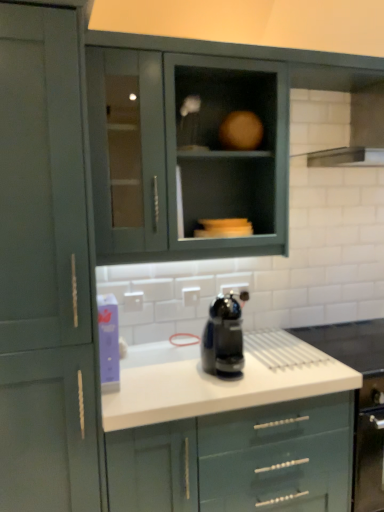
Locate an element on the screen. This screenshot has width=384, height=512. black glossy coffee maker at center is located at coordinates (223, 338).

The image size is (384, 512). Identify the location of matte gray cabinet at upper center, which is the second cabinetry from left to right. (187, 155).

Describe the element at coordinates (338, 126) in the screenshot. I see `stainless steel exhaust hood at upper right` at that location.

The image size is (384, 512). Describe the element at coordinates (44, 269) in the screenshot. I see `matte green cabinet at left, the 1th cabinetry viewed from the left` at that location.

Identify the location of white glossy countertop at center, placed as the 1th cabinetry when sorted from right to left. This screenshot has width=384, height=512. (238, 460).

Based on their positions, is white glossy countertop at center, marked as the 3th cabinetry in a left-to-right arrangement, located to the left or right of matte green cabinet at left, the 1th cabinetry viewed from the left?

Based on their positions, white glossy countertop at center, marked as the 3th cabinetry in a left-to-right arrangement, is located to the right of matte green cabinet at left, the 1th cabinetry viewed from the left.

How different are the orientations of white glossy countertop at center, marked as the 3th cabinetry in a left-to-right arrangement, and matte green cabinet at left, the 1th cabinetry viewed from the left, in degrees?

white glossy countertop at center, marked as the 3th cabinetry in a left-to-right arrangement, and matte green cabinet at left, the 1th cabinetry viewed from the left, are facing 0.000474 degrees away from each other.

From the image's perspective, is white glossy countertop at center, placed as the 1th cabinetry when sorted from right to left, positioned above or below matte green cabinet at left, the third cabinetry from the right?

From the image's perspective, white glossy countertop at center, placed as the 1th cabinetry when sorted from right to left, appears below matte green cabinet at left, the third cabinetry from the right.

From a real-world perspective, is white glossy countertop at center, placed as the 1th cabinetry when sorted from right to left, located higher than matte green cabinet at left, the third cabinetry from the right?

→ No, from a real-world perspective, white glossy countertop at center, placed as the 1th cabinetry when sorted from right to left, is not on top of matte green cabinet at left, the third cabinetry from the right.

How many degrees apart are the facing directions of matte gray cabinet at upper center, which is the second cabinetry from left to right, and white glossy countertop at center, marked as the 3th cabinetry in a left-to-right arrangement?

The facing directions of matte gray cabinet at upper center, which is the second cabinetry from left to right, and white glossy countertop at center, marked as the 3th cabinetry in a left-to-right arrangement, are 0.00132 degrees apart.

Considering the sizes of objects matte gray cabinet at upper center, which is the second cabinetry from left to right, and white glossy countertop at center, placed as the 1th cabinetry when sorted from right to left, in the image provided, who is taller, matte gray cabinet at upper center, which is the second cabinetry from left to right, or white glossy countertop at center, placed as the 1th cabinetry when sorted from right to left,?

white glossy countertop at center, placed as the 1th cabinetry when sorted from right to left, is taller.

From a real-world perspective, who is located higher, matte gray cabinet at upper center, which is counted as the second cabinetry, starting from the right, or white glossy countertop at center, placed as the 1th cabinetry when sorted from right to left?

In real-world perspective, matte gray cabinet at upper center, which is counted as the second cabinetry, starting from the right, is above.

From the picture: Does matte gray cabinet at upper center, which is counted as the second cabinetry, starting from the right, appear on the left side of white glossy countertop at center, placed as the 1th cabinetry when sorted from right to left?

Indeed, matte gray cabinet at upper center, which is counted as the second cabinetry, starting from the right, is positioned on the left side of white glossy countertop at center, placed as the 1th cabinetry when sorted from right to left.

Who is smaller, white glossy countertop at center, placed as the 1th cabinetry when sorted from right to left, or black glossy coffee maker at center?

black glossy coffee maker at center is smaller.

From the image's perspective, is white glossy countertop at center, placed as the 1th cabinetry when sorted from right to left, positioned above or below black glossy coffee maker at center?

Based on their image positions, white glossy countertop at center, placed as the 1th cabinetry when sorted from right to left, is located beneath black glossy coffee maker at center.

Is white glossy countertop at center, marked as the 3th cabinetry in a left-to-right arrangement, aimed at black glossy coffee maker at center?

No, white glossy countertop at center, marked as the 3th cabinetry in a left-to-right arrangement, is not oriented towards black glossy coffee maker at center.

Are white glossy countertop at center, placed as the 1th cabinetry when sorted from right to left, and black glossy coffee maker at center located far from each other?

No, white glossy countertop at center, placed as the 1th cabinetry when sorted from right to left, is in close proximity to black glossy coffee maker at center.

In the scene shown: Considering the positions of objects stainless steel exhaust hood at upper right and matte gray cabinet at upper center, which is the second cabinetry from left to right, in the image provided, who is more to the left, stainless steel exhaust hood at upper right or matte gray cabinet at upper center, which is the second cabinetry from left to right,?

matte gray cabinet at upper center, which is the second cabinetry from left to right.

Is matte gray cabinet at upper center, which is the second cabinetry from left to right, surrounded by stainless steel exhaust hood at upper right?

Actually, matte gray cabinet at upper center, which is the second cabinetry from left to right, is outside stainless steel exhaust hood at upper right.

Which point is more distant from viewer, (356,139) or (128,232)?

The point (356,139) is behind.

Is stainless steel exhaust hood at upper right with matte gray cabinet at upper center, which is the second cabinetry from left to right?

stainless steel exhaust hood at upper right is not next to matte gray cabinet at upper center, which is the second cabinetry from left to right, and they're not touching.

Between stainless steel exhaust hood at upper right and matte green cabinet at left, the 1th cabinetry viewed from the left, which one has larger width?

matte green cabinet at left, the 1th cabinetry viewed from the left, is wider.

Locate an element on the screen. This screenshot has height=512, width=384. exhaust hood behind the matte green cabinet at left, the 1th cabinetry viewed from the left is located at coordinates (338, 126).

From a real-world perspective, who is located lower, stainless steel exhaust hood at upper right or matte green cabinet at left, the third cabinetry from the right?

From a 3D spatial view, matte green cabinet at left, the third cabinetry from the right, is below.

From their relative heights in the image, would you say stainless steel exhaust hood at upper right is taller or shorter than matte green cabinet at left, the 1th cabinetry viewed from the left?

Considering their sizes, stainless steel exhaust hood at upper right has less height than matte green cabinet at left, the 1th cabinetry viewed from the left.

Is matte green cabinet at left, the 1th cabinetry viewed from the left, completely or partially outside of stainless steel exhaust hood at upper right?

Yes, matte green cabinet at left, the 1th cabinetry viewed from the left, is outside of stainless steel exhaust hood at upper right.

Is point (30, 420) positioned in front of point (316, 106)?

Yes, it is.

Is matte green cabinet at left, the 1th cabinetry viewed from the left, behind stainless steel exhaust hood at upper right?

No, the depth of matte green cabinet at left, the 1th cabinetry viewed from the left, is less than that of stainless steel exhaust hood at upper right.

Who is bigger, matte green cabinet at left, the 1th cabinetry viewed from the left, or stainless steel exhaust hood at upper right?

Bigger between the two is matte green cabinet at left, the 1th cabinetry viewed from the left.

Is black glossy coffee maker at center oriented towards matte gray cabinet at upper center, which is the second cabinetry from left to right?

No.

From their relative heights in the image, would you say black glossy coffee maker at center is taller or shorter than matte gray cabinet at upper center, which is the second cabinetry from left to right?

Considering their sizes, black glossy coffee maker at center has less height than matte gray cabinet at upper center, which is the second cabinetry from left to right.

Consider the image. Is black glossy coffee maker at center positioned far away from matte gray cabinet at upper center, which is the second cabinetry from left to right?

No, black glossy coffee maker at center is not far from matte gray cabinet at upper center, which is the second cabinetry from left to right.

Is black glossy coffee maker at center outside of matte gray cabinet at upper center, which is counted as the second cabinetry, starting from the right?

That's correct, black glossy coffee maker at center is outside of matte gray cabinet at upper center, which is counted as the second cabinetry, starting from the right.

This screenshot has width=384, height=512. Find the location of `cabinetry that appears below the matte green cabinet at left, the third cabinetry from the right (from a real-world perspective)`. cabinetry that appears below the matte green cabinet at left, the third cabinetry from the right (from a real-world perspective) is located at coordinates (238, 460).

Image resolution: width=384 pixels, height=512 pixels. Find the location of `cabinetry that is the 2nd object above the white glossy countertop at center, marked as the 3th cabinetry in a left-to-right arrangement (from a real-world perspective)`. cabinetry that is the 2nd object above the white glossy countertop at center, marked as the 3th cabinetry in a left-to-right arrangement (from a real-world perspective) is located at coordinates (187, 155).

In the scene shown: Based on their spatial positions, is stainless steel exhaust hood at upper right or matte gray cabinet at upper center, which is the second cabinetry from left to right, further from black glossy coffee maker at center?

Based on the image, stainless steel exhaust hood at upper right appears to be further to black glossy coffee maker at center.

When comparing their distances from matte gray cabinet at upper center, which is the second cabinetry from left to right, does matte green cabinet at left, the 1th cabinetry viewed from the left, or white glossy countertop at center, placed as the 1th cabinetry when sorted from right to left, seem further?

white glossy countertop at center, placed as the 1th cabinetry when sorted from right to left, is positioned further to the anchor matte gray cabinet at upper center, which is the second cabinetry from left to right.

From the image, which object appears to be farther from matte gray cabinet at upper center, which is counted as the second cabinetry, starting from the right, black glossy coffee maker at center or white glossy countertop at center, placed as the 1th cabinetry when sorted from right to left?

Among the two, white glossy countertop at center, placed as the 1th cabinetry when sorted from right to left, is located further to matte gray cabinet at upper center, which is counted as the second cabinetry, starting from the right.

Considering their positions, is stainless steel exhaust hood at upper right positioned further to matte green cabinet at left, the 1th cabinetry viewed from the left, than black glossy coffee maker at center?

stainless steel exhaust hood at upper right.

When comparing their distances from black glossy coffee maker at center, does white glossy countertop at center, placed as the 1th cabinetry when sorted from right to left, or stainless steel exhaust hood at upper right seem closer?

The object closer to black glossy coffee maker at center is white glossy countertop at center, placed as the 1th cabinetry when sorted from right to left.

Based on their spatial positions, is black glossy coffee maker at center or matte gray cabinet at upper center, which is counted as the second cabinetry, starting from the right, further from matte green cabinet at left, the third cabinetry from the right?

matte gray cabinet at upper center, which is counted as the second cabinetry, starting from the right, is positioned further to the anchor matte green cabinet at left, the third cabinetry from the right.

From the picture: Which object lies further to the anchor point black glossy coffee maker at center, stainless steel exhaust hood at upper right or matte green cabinet at left, the third cabinetry from the right?

Based on the image, stainless steel exhaust hood at upper right appears to be further to black glossy coffee maker at center.

Based on their spatial positions, is white glossy countertop at center, placed as the 1th cabinetry when sorted from right to left, or matte green cabinet at left, the third cabinetry from the right, closer to black glossy coffee maker at center?

white glossy countertop at center, placed as the 1th cabinetry when sorted from right to left, is closer to black glossy coffee maker at center.

Locate an element on the screen. home appliance between stainless steel exhaust hood at upper right and white glossy countertop at center, placed as the 1th cabinetry when sorted from right to left, vertically is located at coordinates (223, 338).

The width and height of the screenshot is (384, 512). I want to click on cabinetry between matte gray cabinet at upper center, which is the second cabinetry from left to right, and white glossy countertop at center, marked as the 3th cabinetry in a left-to-right arrangement, in the up-down direction, so click(44, 269).

You are a GUI agent. You are given a task and a screenshot of the screen. Output one action in this format:
    pyautogui.click(x=<x>, y=<y>)
    Task: Click on the home appliance between matte green cabinet at left, the third cabinetry from the right, and stainless steel exhaust hood at upper right from left to right
    Image resolution: width=384 pixels, height=512 pixels.
    Given the screenshot: What is the action you would take?
    point(223,338)

Identify the location of cabinetry that lies between matte gray cabinet at upper center, which is counted as the second cabinetry, starting from the right, and black glossy coffee maker at center from top to bottom. The image size is (384, 512). (44, 269).